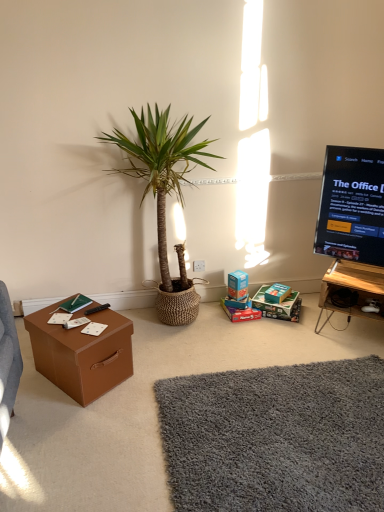
This screenshot has height=512, width=384. What are the coordinates of `free point in front of matte cardboard box at lower center, the 1th storage box viewed from the left` in the screenshot? It's located at (243, 330).